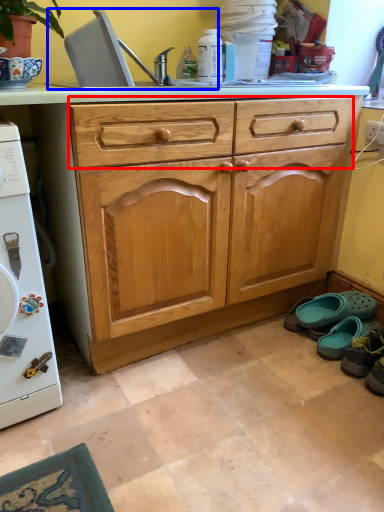
Question: Which object is further to the camera taking this photo, drawer (highlighted by a red box) or sink (highlighted by a blue box)?

Choices:
 (A) drawer
 (B) sink

Answer: (B)